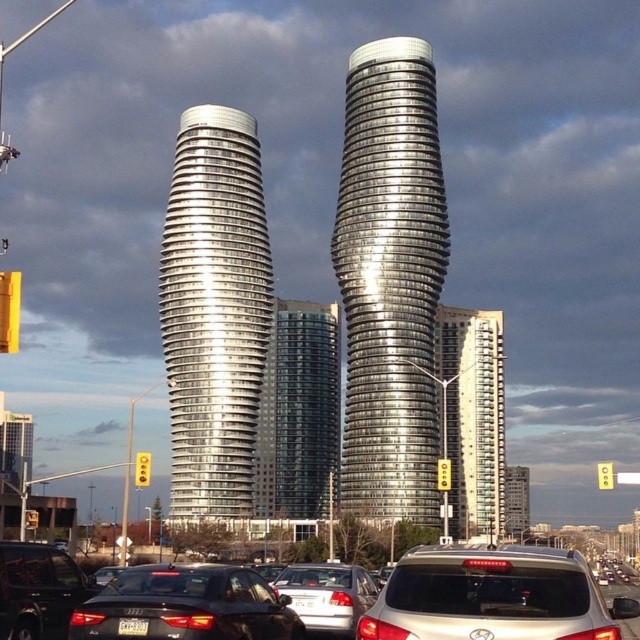
Question: Among these points, which one is nearest to the camera?

Choices:
 (A) (284, 404)
 (B) (401, 456)
 (C) (632, 616)
 (D) (51, 545)

Answer: (C)

Question: Is glassy silver skyscraper at center positioned in front of satin silver sedan at center?

Choices:
 (A) no
 (B) yes

Answer: (A)

Question: Considering the real-world distances, which object is closest to the silver metallic suv at center?

Choices:
 (A) black glossy sedan at lower left
 (B) silver glass building at center
 (C) metallic glass building at center
 (D) satin silver suv at center

Answer: (A)

Question: Which point is closer to the camera?

Choices:
 (A) (38, 570)
 (B) (324, 616)
 (C) (566, 573)
 (D) (326, 440)

Answer: (C)

Question: Does black glossy sedan at lower center appear on the left side of black glossy sedan at lower left?

Choices:
 (A) yes
 (B) no

Answer: (B)

Question: Can you confirm if silver metallic suv at center is positioned below silver glass building at center?

Choices:
 (A) yes
 (B) no

Answer: (A)